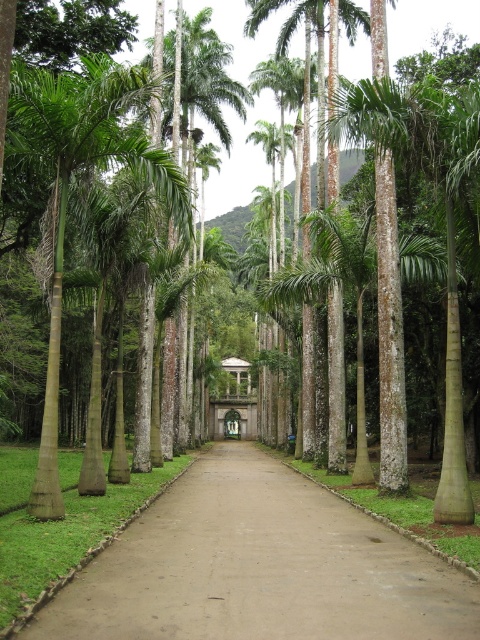
Question: Considering the real-world distances, which object is farthest from the brown dirt path at center?

Choices:
 (A) green leafy palm tree at center
 (B) green smooth palm tree at left
 (C) green textured palm tree at center

Answer: (A)

Question: Can you confirm if green smooth palm tree at left is smaller than green leafy palm tree at center?

Choices:
 (A) no
 (B) yes

Answer: (B)

Question: From the image, what is the correct spatial relationship of brown dirt path at center in relation to green textured palm tree at center?

Choices:
 (A) left
 (B) right

Answer: (A)

Question: Estimate the real-world distances between objects in this image. Which object is farther from the green leafy palm tree at center?

Choices:
 (A) green textured palm tree at center
 (B) green smooth palm tree at left
 (C) brown dirt path at center

Answer: (B)

Question: Which object appears closest to the camera in this image?

Choices:
 (A) green leafy palm tree at center
 (B) brown dirt path at center

Answer: (B)

Question: From the image, what is the correct spatial relationship of brown dirt path at center in relation to green smooth palm tree at left?

Choices:
 (A) right
 (B) left

Answer: (A)